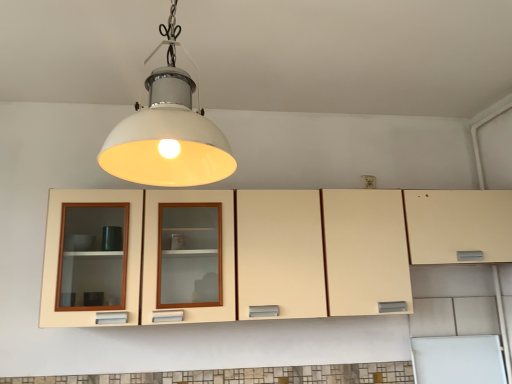
Question: Does matte cream cabinet at center lie in front of white matte lampshade at center?

Choices:
 (A) yes
 (B) no

Answer: (B)

Question: Can you confirm if matte cream cabinet at center is positioned to the left of white matte lampshade at center?

Choices:
 (A) no
 (B) yes

Answer: (A)

Question: Considering the relative sizes of matte cream cabinet at center and white matte lampshade at center in the image provided, is matte cream cabinet at center wider than white matte lampshade at center?

Choices:
 (A) no
 (B) yes

Answer: (A)

Question: Does matte cream cabinet at center have a greater height compared to white matte lampshade at center?

Choices:
 (A) no
 (B) yes

Answer: (A)

Question: From the image's perspective, is matte cream cabinet at center below white matte lampshade at center?

Choices:
 (A) no
 (B) yes

Answer: (B)

Question: Is matte cream cabinet at center to the right of white matte lampshade at center from the viewer's perspective?

Choices:
 (A) yes
 (B) no

Answer: (A)

Question: Would you say white matte lampshade at center is a long distance from matte cream cabinet at center?

Choices:
 (A) no
 (B) yes

Answer: (A)

Question: Is white matte lampshade at center with matte cream cabinet at center?

Choices:
 (A) yes
 (B) no

Answer: (B)

Question: Considering the relative positions of white matte lampshade at center and matte cream cabinet at center in the image provided, is white matte lampshade at center to the right of matte cream cabinet at center from the viewer's perspective?

Choices:
 (A) yes
 (B) no

Answer: (B)

Question: Does white matte lampshade at center have a larger size compared to matte cream cabinet at center?

Choices:
 (A) yes
 (B) no

Answer: (B)

Question: Is white matte lampshade at center behind matte cream cabinet at center?

Choices:
 (A) yes
 (B) no

Answer: (B)

Question: Is white matte lampshade at center facing away from matte cream cabinet at center?

Choices:
 (A) no
 (B) yes

Answer: (A)

Question: From a real-world perspective, is white matte lampshade at center physically located above or below matte cream cabinet at center?

Choices:
 (A) below
 (B) above

Answer: (B)